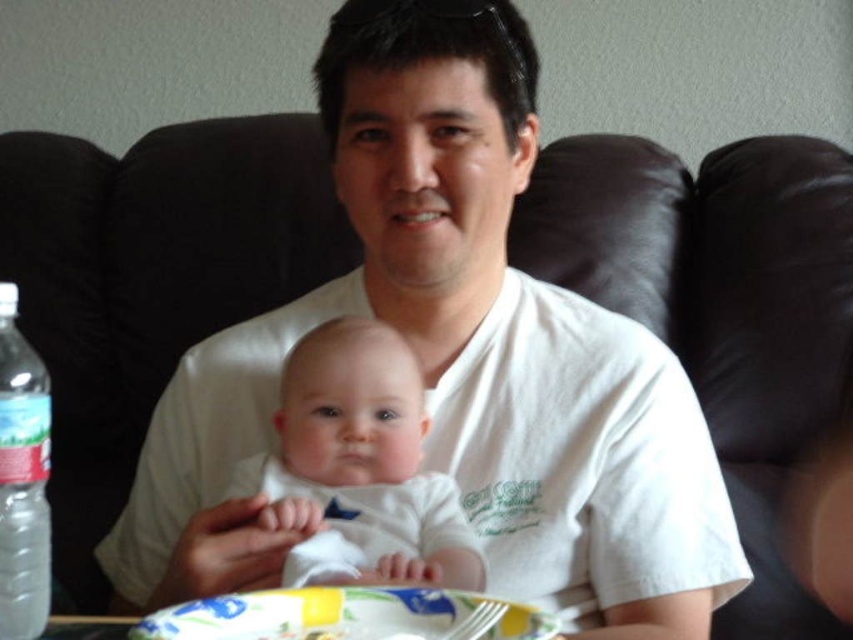
Question: Can you confirm if white soft fabric baby at center is smaller than yellow paper plate at lower center?

Choices:
 (A) no
 (B) yes

Answer: (A)

Question: From the image, what is the correct spatial relationship of white soft fabric baby at center in relation to clear plastic bottle at left?

Choices:
 (A) left
 (B) right

Answer: (B)

Question: Which point appears farthest from the camera in this image?

Choices:
 (A) (354, 621)
 (B) (355, 548)

Answer: (B)

Question: Is yellow paper plate at lower center wider than clear plastic bottle at left?

Choices:
 (A) no
 (B) yes

Answer: (B)

Question: Considering the real-world distances, which object is farthest from the white soft fabric baby at center?

Choices:
 (A) yellow paper plate at lower center
 (B) clear plastic bottle at left

Answer: (B)

Question: Which object is closer to the camera taking this photo?

Choices:
 (A) yellow paper plate at lower center
 (B) clear plastic bottle at left
 (C) white soft fabric baby at center

Answer: (A)